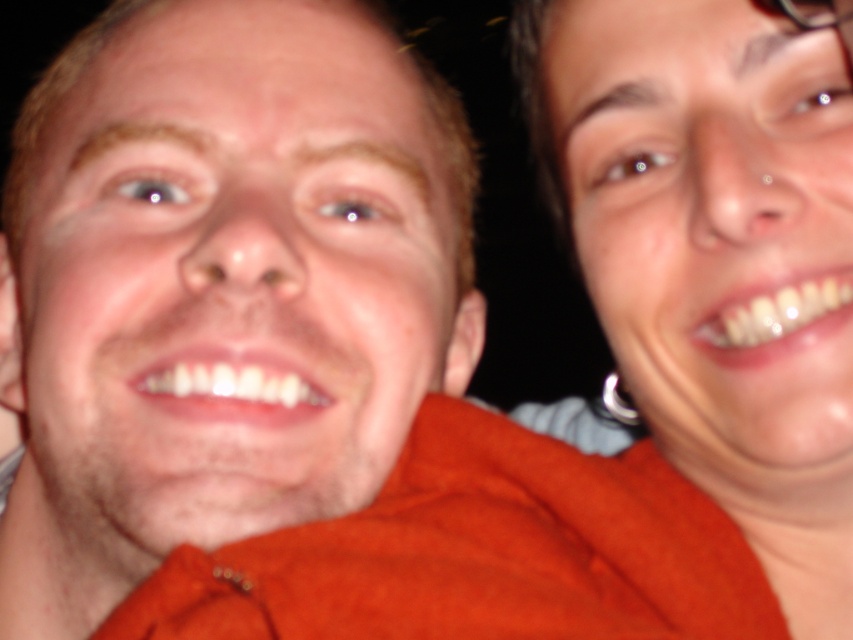
You are designing a photo filter that adjusts brightness based on object sizes. The filter increases brightness for larger objects and decreases it for smaller ones. Given the image described, which object between the matte orange shirt at left and the matte skin at right will have its brightness increased by the filter?

The matte orange shirt at left is bigger than the matte skin at right, so the filter will increase the brightness of the matte orange shirt at left.

You are taking a selfie with two friends. You notice the matte orange shirt at left and the matte skin at right in the frame. Which object is positioned further to the left in the image?

The matte orange shirt at left is positioned further to the left than the matte skin at right.

You are taking a selfie with a friend. You are standing at point (334,268). Your friend is standing at point 0.581, 0.607. The recommended distance for a perfect selfie is between 12 to 18 inches. Is your current distance within the recommended range?

The distance between you and your friend is 16.62 inches, which falls within the recommended range of 12 to 18 inches for a perfect selfie.